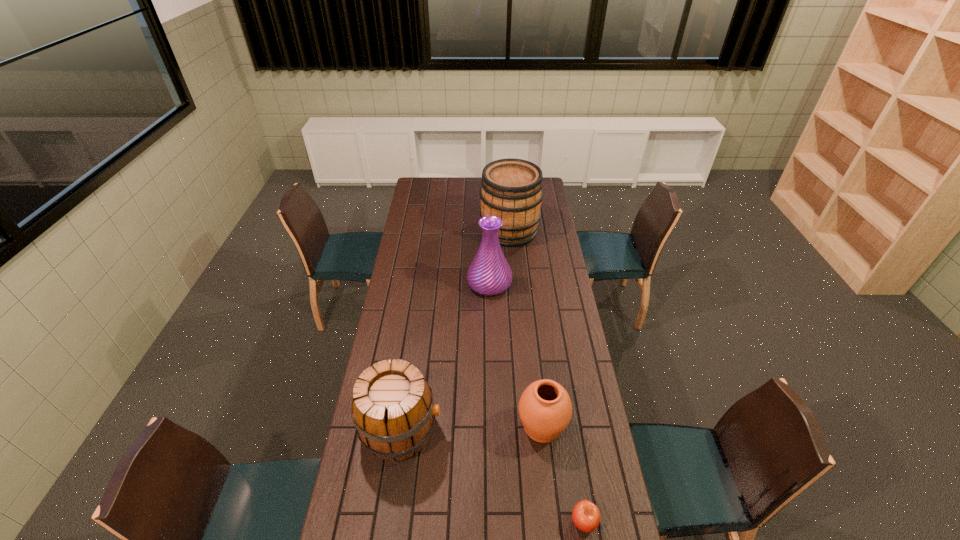
At what (x,y) coordinates should I click in order to perform the action: click on the right cider. Please return your answer as a coordinate pair (x, y). The height and width of the screenshot is (540, 960). Looking at the image, I should click on (511, 189).

Find the location of `the farther cider`. the farther cider is located at coordinates (511, 189).

This screenshot has width=960, height=540. I want to click on vase, so click(489, 273).

Image resolution: width=960 pixels, height=540 pixels. Find the location of `the nearer cider`. the nearer cider is located at coordinates (392, 407).

Where is `the third tallest object`? The image size is (960, 540). the third tallest object is located at coordinates (392, 407).

Where is `the second shortest object`? The width and height of the screenshot is (960, 540). the second shortest object is located at coordinates (545, 409).

The height and width of the screenshot is (540, 960). I want to click on apple, so click(x=586, y=516).

This screenshot has height=540, width=960. I want to click on the shortest object, so click(586, 516).

This screenshot has height=540, width=960. Identify the location of free space located on the front of the taller cider. (514, 287).

Identify the location of vacant space located 0.280m on the front of the vase. (491, 348).